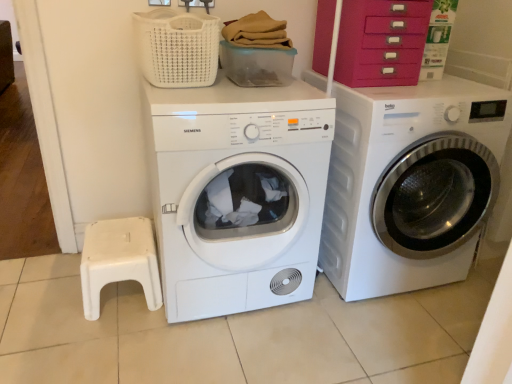
Locate an element on the screen. The width and height of the screenshot is (512, 384). free space in front of white glossy washing machine at right, which appears as the 1th washing machine when viewed from the right is located at coordinates (370, 339).